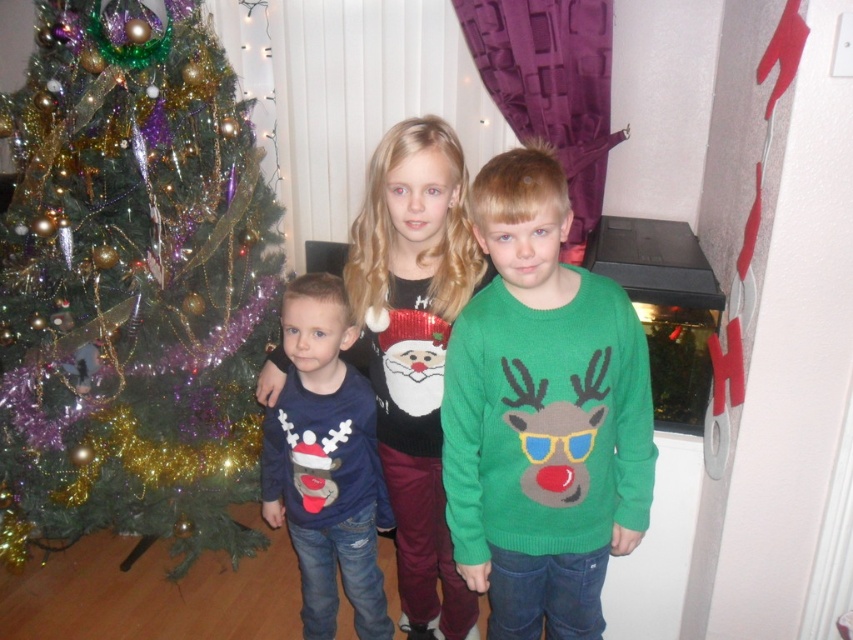
This screenshot has width=853, height=640. I want to click on shiny green christmas tree at left, so click(x=131, y=284).

Which is in front, point (61, 54) or point (427, 408)?

Point (427, 408) is in front.

Is point (38, 330) in front of point (468, 605)?

No, it is not.

Where is `shiny green christmas tree at left`? This screenshot has height=640, width=853. shiny green christmas tree at left is located at coordinates (131, 284).

Who is shorter, shiny green christmas tree at left or matte blue sweater at center?

matte blue sweater at center

Does point (187, 461) come closer to viewer compared to point (281, 400)?

No.

Where is `shiny green christmas tree at left`? Image resolution: width=853 pixels, height=640 pixels. shiny green christmas tree at left is located at coordinates [x=131, y=284].

Can you confirm if shiny sequin sweater at center is bigger than matte blue sweater at center?

Yes, shiny sequin sweater at center is bigger than matte blue sweater at center.

Image resolution: width=853 pixels, height=640 pixels. Describe the element at coordinates (415, 348) in the screenshot. I see `shiny sequin sweater at center` at that location.

Locate an element on the screen. This screenshot has width=853, height=640. shiny sequin sweater at center is located at coordinates (415, 348).